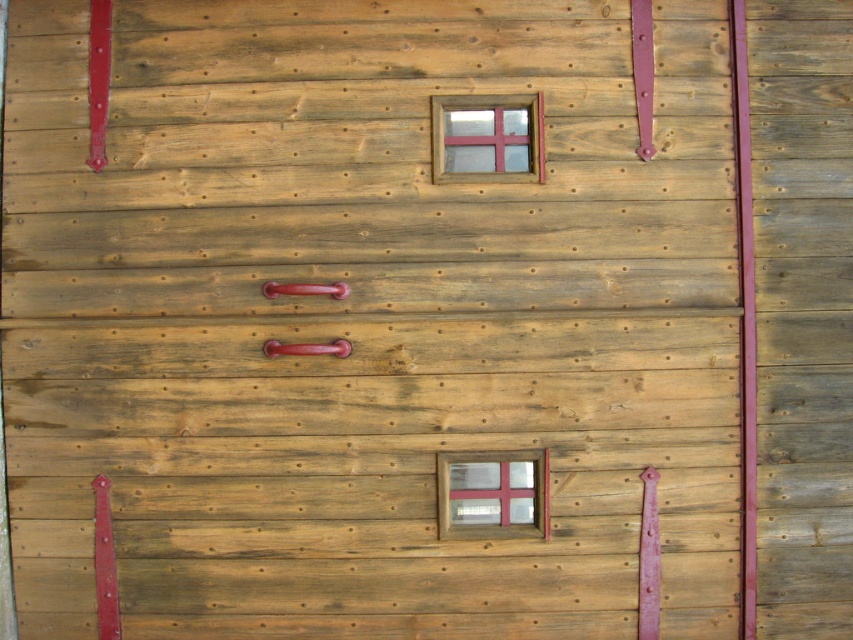
Can you confirm if matte wooden window at upper center is thinner than wooden frame window at center?

No.

Which is in front, point (521, 96) or point (503, 516)?

Point (521, 96)

Who is more distant from viewer, (543, 179) or (508, 458)?

Point (508, 458)

This screenshot has height=640, width=853. In order to click on matte wooden window at upper center in this screenshot , I will do `click(486, 138)`.

Between matte wooden window at upper center and glossy metal handle at center, which one appears on the left side from the viewer's perspective?

glossy metal handle at center

Can you confirm if matte wooden window at upper center is positioned to the right of glossy metal handle at center?

Indeed, matte wooden window at upper center is positioned on the right side of glossy metal handle at center.

Locate an element on the screen. This screenshot has width=853, height=640. matte wooden window at upper center is located at coordinates (486, 138).

What are the coordinates of `matte wooden window at upper center` in the screenshot? It's located at (486, 138).

Who is taller, wooden frame window at center or shiny red metal handle at center?

Standing taller between the two is wooden frame window at center.

Can you confirm if wooden frame window at center is thinner than shiny red metal handle at center?

In fact, wooden frame window at center might be wider than shiny red metal handle at center.

Does point (468, 532) come behind point (302, 289)?

Yes, point (468, 532) is behind point (302, 289).

I want to click on wooden frame window at center, so click(x=492, y=493).